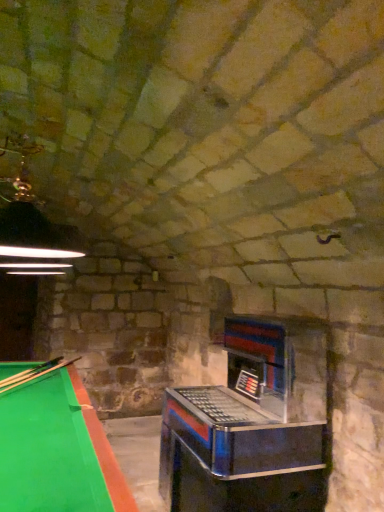
Image resolution: width=384 pixels, height=512 pixels. I want to click on metallic/reflective slot machine at center-right, so click(x=251, y=426).

Based on the photo, in order to face metallic/reflective slot machine at center-right, should I rotate leftwards or rightwards?

You should rotate right by 5.386 degrees.

What do you see at coordinates (251, 426) in the screenshot? The width and height of the screenshot is (384, 512). I see `metallic/reflective slot machine at center-right` at bounding box center [251, 426].

Identify the location of wooden smooth cue at lower left. (34, 373).

What do you see at coordinates (34, 373) in the screenshot?
I see `wooden smooth cue at lower left` at bounding box center [34, 373].

Measure the distance between point (27, 376) and camera.

A distance of 9.73 feet exists between point (27, 376) and camera.

The image size is (384, 512). I want to click on metallic/reflective slot machine at center-right, so click(x=251, y=426).

Can you confirm if wooden smooth cue at lower left is positioned to the right of metallic/reflective slot machine at center-right?

Incorrect, wooden smooth cue at lower left is not on the right side of metallic/reflective slot machine at center-right.

Considering the positions of objects wooden smooth cue at lower left and metallic/reflective slot machine at center-right in the image provided, who is behind, wooden smooth cue at lower left or metallic/reflective slot machine at center-right?

wooden smooth cue at lower left is behind.

Is point (5, 385) farther from viewer compared to point (204, 435)?

Yes, it is behind point (204, 435).

From the image's perspective, who appears lower, wooden smooth cue at lower left or metallic/reflective slot machine at center-right?

metallic/reflective slot machine at center-right appears lower in the image.

From a real-world perspective, is wooden smooth cue at lower left on top of metallic/reflective slot machine at center-right?

Yes.

Which object is wider, wooden smooth cue at lower left or metallic/reflective slot machine at center-right?

Wider between the two is wooden smooth cue at lower left.

Is wooden smooth cue at lower left taller than metallic/reflective slot machine at center-right?

Incorrect, the height of wooden smooth cue at lower left is not larger of that of metallic/reflective slot machine at center-right.

Who is bigger, wooden smooth cue at lower left or metallic/reflective slot machine at center-right?

metallic/reflective slot machine at center-right.

Is wooden smooth cue at lower left not within metallic/reflective slot machine at center-right?

That's correct, wooden smooth cue at lower left is outside of metallic/reflective slot machine at center-right.

Is wooden smooth cue at lower left far away from metallic/reflective slot machine at center-right?

Yes, wooden smooth cue at lower left and metallic/reflective slot machine at center-right are located far from each other.

Is wooden smooth cue at lower left oriented away from metallic/reflective slot machine at center-right?

That's not correct — wooden smooth cue at lower left is not looking away from metallic/reflective slot machine at center-right.

What's the angular difference between wooden smooth cue at lower left and metallic/reflective slot machine at center-right's facing directions?

wooden smooth cue at lower left and metallic/reflective slot machine at center-right are facing 62.3 degrees away from each other.

Where is `slot machine lying on the right of wooden smooth cue at lower left`? The width and height of the screenshot is (384, 512). slot machine lying on the right of wooden smooth cue at lower left is located at coordinates pyautogui.click(x=251, y=426).

Is metallic/reflective slot machine at center-right at the left side of wooden smooth cue at lower left?

No, metallic/reflective slot machine at center-right is not to the left of wooden smooth cue at lower left.

Which object is more forward, metallic/reflective slot machine at center-right or wooden smooth cue at lower left?

metallic/reflective slot machine at center-right is in front.

Is point (163, 444) behind point (29, 377)?

Yes.

Looking at this image, from the image's perspective, relative to wooden smooth cue at lower left, is metallic/reflective slot machine at center-right above or below?

From the image's perspective, metallic/reflective slot machine at center-right appears below wooden smooth cue at lower left.

From a real-world perspective, between metallic/reflective slot machine at center-right and wooden smooth cue at lower left, who is vertically higher?

wooden smooth cue at lower left is physically above.

Is metallic/reflective slot machine at center-right wider or thinner than wooden smooth cue at lower left?

In the image, metallic/reflective slot machine at center-right appears to be more narrow than wooden smooth cue at lower left.

Looking at this image, is metallic/reflective slot machine at center-right shorter than wooden smooth cue at lower left?

No.

Which of these two, metallic/reflective slot machine at center-right or wooden smooth cue at lower left, is bigger?

Bigger between the two is metallic/reflective slot machine at center-right.

Could wooden smooth cue at lower left be considered to be inside metallic/reflective slot machine at center-right?

That's incorrect, wooden smooth cue at lower left is not inside metallic/reflective slot machine at center-right.

Is metallic/reflective slot machine at center-right not near wooden smooth cue at lower left?

Yes, metallic/reflective slot machine at center-right and wooden smooth cue at lower left are located far from each other.

Could you tell me if metallic/reflective slot machine at center-right is turned towards wooden smooth cue at lower left?

No, metallic/reflective slot machine at center-right does not turn towards wooden smooth cue at lower left.

Can you tell me how much metallic/reflective slot machine at center-right and wooden smooth cue at lower left differ in facing direction?

62.3 degrees.

This screenshot has width=384, height=512. In order to click on cue above the metallic/reflective slot machine at center-right (from a real-world perspective) in this screenshot , I will do `click(34, 373)`.

The width and height of the screenshot is (384, 512). Identify the location of cue above the metallic/reflective slot machine at center-right (from a real-world perspective). (34, 373).

Find the location of a particular element. The height and width of the screenshot is (512, 384). slot machine that appears on the right of wooden smooth cue at lower left is located at coordinates (251, 426).